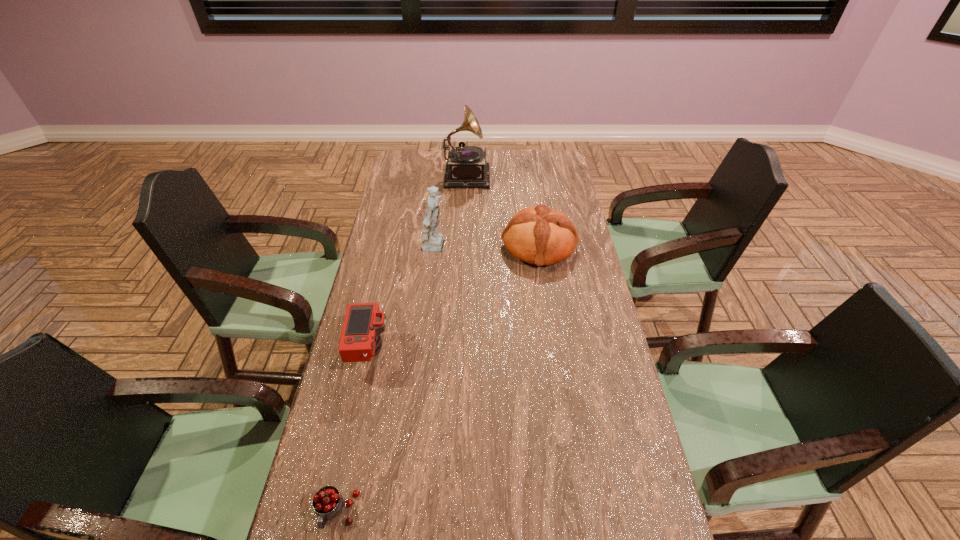
Identify the location of free area in between the fourth farthest object and the bread. The height and width of the screenshot is (540, 960). (454, 299).

Locate an element on the screen. The height and width of the screenshot is (540, 960). vacant space in between the nearest object and the record player is located at coordinates (401, 343).

You are a GUI agent. You are given a task and a screenshot of the screen. Output one action in this format:
    pyautogui.click(x=<x>, y=<y>)
    Task: Click on the free space between the shortest object and the record player
    
    Given the screenshot: What is the action you would take?
    pyautogui.click(x=401, y=343)

The width and height of the screenshot is (960, 540). In order to click on vacant point located between the farthest object and the figurine in this screenshot , I will do `click(451, 211)`.

Image resolution: width=960 pixels, height=540 pixels. In order to click on free space between the bread and the farthest object in this screenshot , I will do `click(503, 210)`.

Image resolution: width=960 pixels, height=540 pixels. I want to click on vacant point located between the nearest object and the rightmost object, so click(438, 379).

You are a GUI agent. You are given a task and a screenshot of the screen. Output one action in this format:
    pyautogui.click(x=<x>, y=<y>)
    Task: Click on the vacant space that is in between the rightmost object and the record player
    This screenshot has width=960, height=540.
    Given the screenshot: What is the action you would take?
    pyautogui.click(x=503, y=210)

Find the location of a particular element. Image resolution: width=960 pixels, height=540 pixels. the third closest object relative to the camera is located at coordinates (538, 235).

Point out which object is positioned as the nearest to the shortest object. Please provide its 2D coordinates. Your answer should be formatted as a tuple, i.e. [(x, y)], where the tuple contains the x and y coordinates of a point satisfying the conditions above.

[(360, 340)]

The image size is (960, 540). I want to click on vacant point that satisfies the following two spatial constraints: 1. on the horn of the rightmost object; 2. on the right side of the tallest object, so click(x=463, y=246).